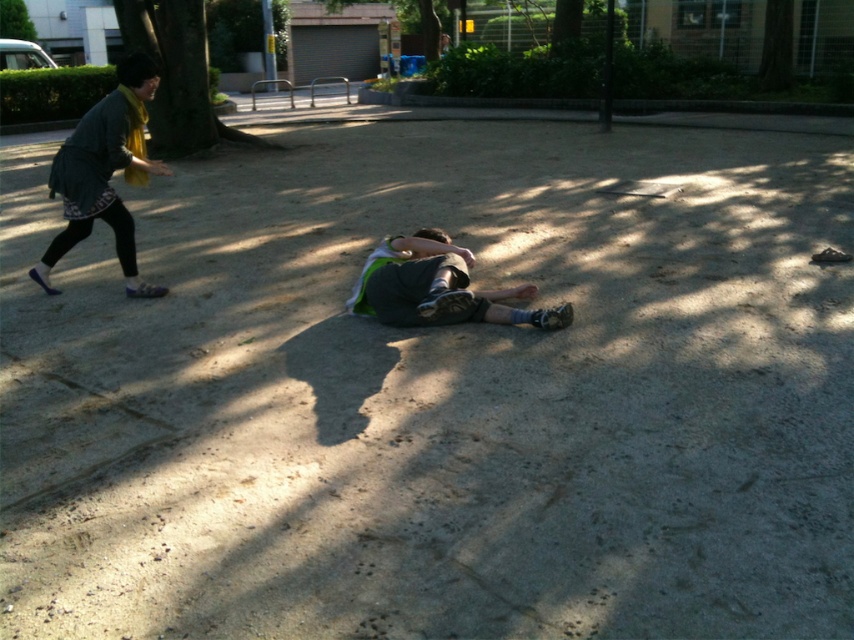
Which of these two, green fabric shirt at center or green fabric shorts at center, stands taller?

With more height is green fabric shirt at center.

Who is lower down, green fabric shirt at center or green fabric shorts at center?

green fabric shorts at center is below.

What do you see at coordinates (104, 172) in the screenshot? The image size is (854, 640). I see `green fabric shirt at center` at bounding box center [104, 172].

What are the coordinates of `green fabric shirt at center` in the screenshot? It's located at (104, 172).